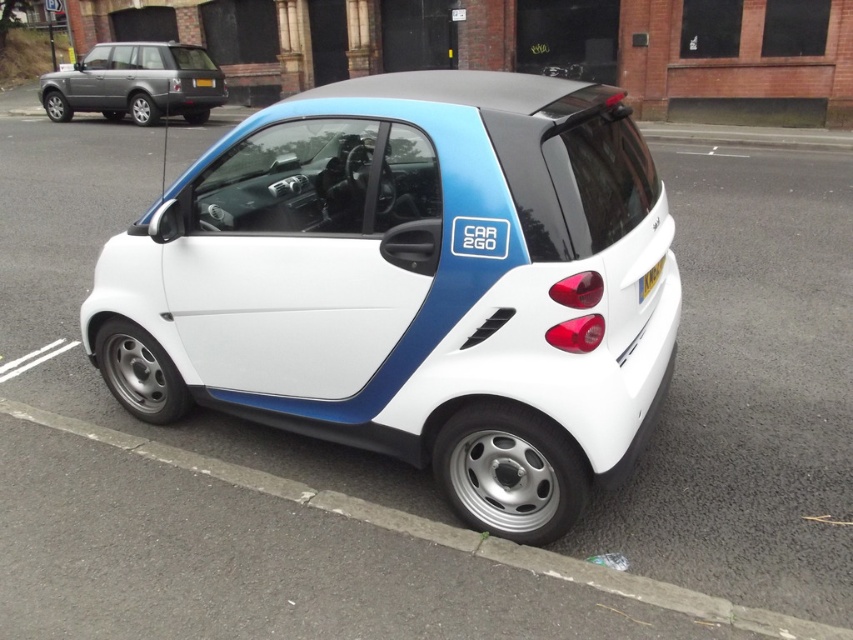
You are a delivery person trying to park your van next to the gray asphalt curb at lower center and the silver metallic suv at upper left. Based on their heights, which vehicle should you avoid parking too close to to prevent scraping the van?

The gray asphalt curb at lower center is taller than the silver metallic suv at upper left, so you should avoid parking too close to the gray asphalt curb at lower center to prevent scraping the van.

You are standing on the sidewalk and looking at the Smart Fortwo car. There are two points marked on the car. Which of the two points, point (132, 340) or point (479, 536), is closer to you?

Point (132, 340) is closer to you because it is further to the viewer than point (479, 536).